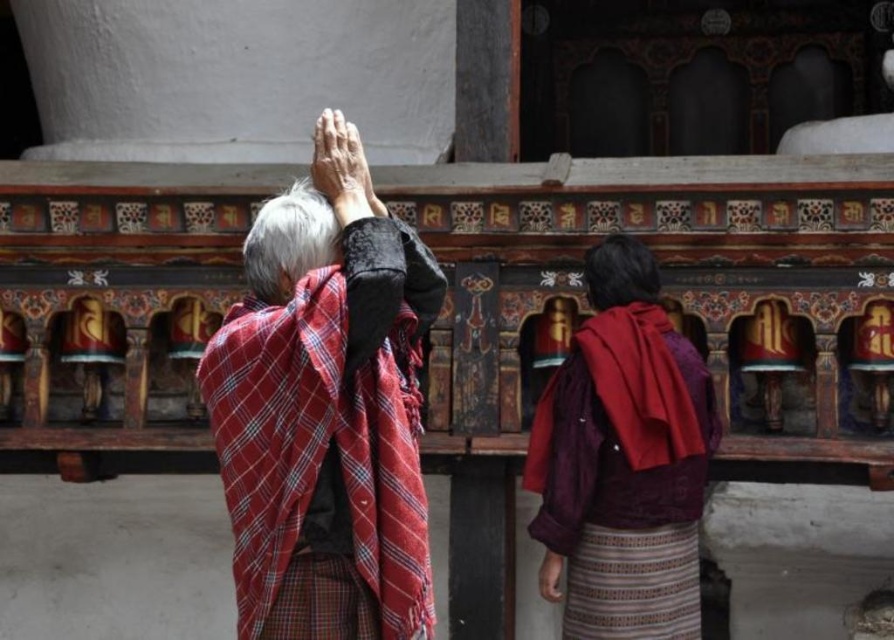
Question: Does red plaid shawl at center come in front of maroon textured shawl at center?

Choices:
 (A) no
 (B) yes

Answer: (B)

Question: Can you confirm if red plaid shawl at center is positioned to the right of maroon textured shawl at center?

Choices:
 (A) yes
 (B) no

Answer: (B)

Question: Which point is closer to the camera taking this photo?

Choices:
 (A) (578, 486)
 (B) (260, 444)

Answer: (B)

Question: Which point is closer to the camera taking this photo?

Choices:
 (A) (606, 252)
 (B) (270, 323)

Answer: (B)

Question: Considering the relative positions of red plaid shawl at center and maroon textured shawl at center in the image provided, where is red plaid shawl at center located with respect to maroon textured shawl at center?

Choices:
 (A) left
 (B) right

Answer: (A)

Question: Which point appears farthest from the camera in this image?

Choices:
 (A) (589, 316)
 (B) (339, 470)

Answer: (A)